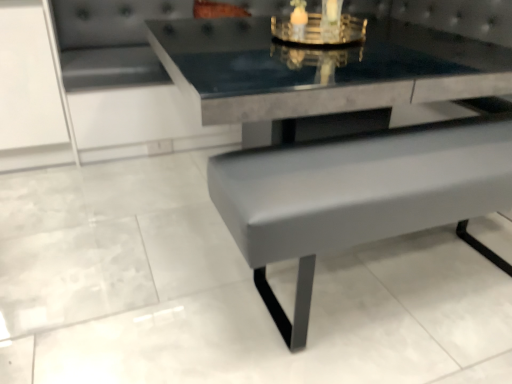
Question: Considering their positions, is gold metallic candle holder at upper center located in front of or behind matte gray bench at lower right?

Choices:
 (A) behind
 (B) front

Answer: (A)

Question: Is gold metallic candle holder at upper center inside the boundaries of matte gray bench at lower right, or outside?

Choices:
 (A) inside
 (B) outside

Answer: (B)

Question: Based on their positions, is gold metallic candle holder at upper center located to the left or right of matte gray bench at lower right?

Choices:
 (A) left
 (B) right

Answer: (A)

Question: Based on their sizes in the image, would you say matte gray bench at lower right is bigger or smaller than gold metallic candle holder at upper center?

Choices:
 (A) big
 (B) small

Answer: (A)

Question: Is matte gray bench at lower right inside or outside of gold metallic candle holder at upper center?

Choices:
 (A) inside
 (B) outside

Answer: (B)

Question: Considering the relative positions of matte gray bench at lower right and gold metallic candle holder at upper center in the image provided, is matte gray bench at lower right to the left or to the right of gold metallic candle holder at upper center?

Choices:
 (A) left
 (B) right

Answer: (B)

Question: Looking at their shapes, would you say matte gray bench at lower right is wider or thinner than gold metallic candle holder at upper center?

Choices:
 (A) thin
 (B) wide

Answer: (B)